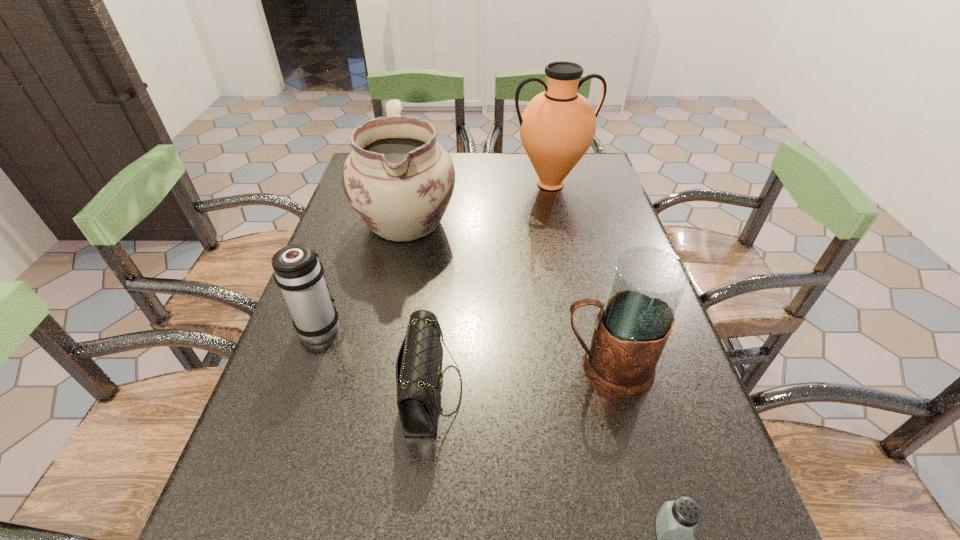
What are the coordinates of `blank space that satisfies the following two spatial constraints: 1. on the side with the handle of the tallest object; 2. on the left side of the fourth tallest object` in the screenshot? It's located at (370, 184).